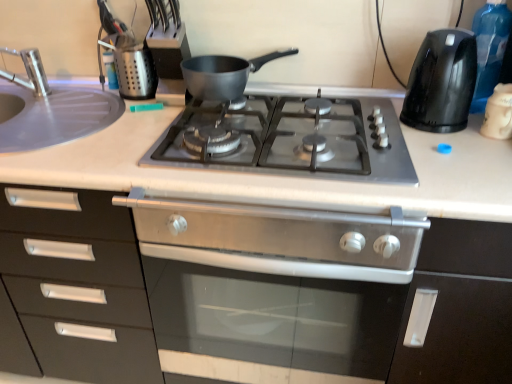
Where is `free location to the left of metallic silver utensil holder at upper left`? free location to the left of metallic silver utensil holder at upper left is located at coordinates (80, 97).